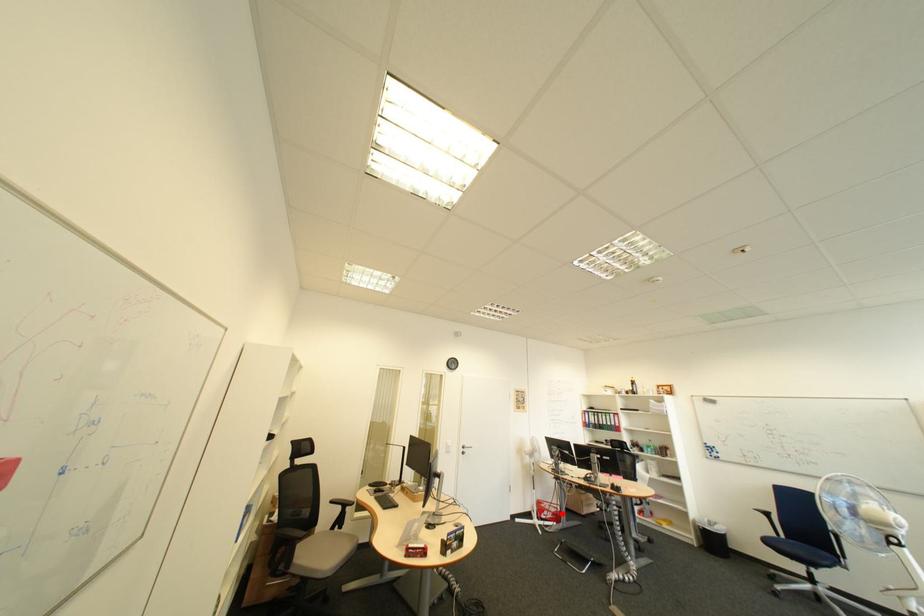
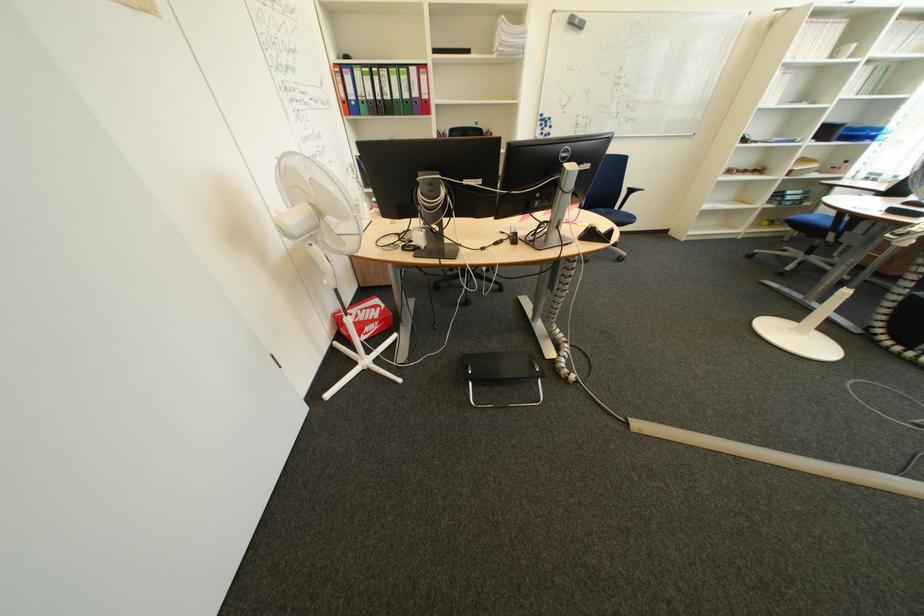
Question: A red point is marked in image1. In image2, is the corresponding 3D point closer to the camera or farther? Reply with the corresponding letter.

Choices:
 (A) The corresponding 3D point is closer.
 (B) The corresponding 3D point is farther.

Answer: (A)